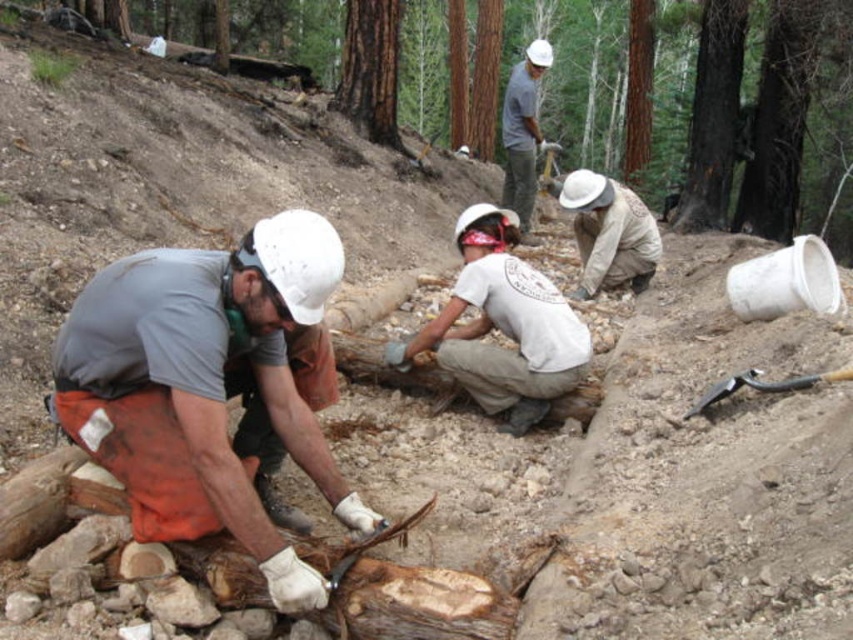
Question: Which point is farther from the camera taking this photo?

Choices:
 (A) coord(293,237)
 (B) coord(567,193)
 (C) coord(538,42)
 (D) coord(837,380)

Answer: (C)

Question: Considering the real-world distances, which object is closest to the camouflage fabric shirt at center?

Choices:
 (A) black metal shovel at lower center
 (B) white matte helmet at center

Answer: (B)

Question: Which of the following is the farthest from the observer?

Choices:
 (A) black metal shovel at lower center
 (B) camouflage fabric shirt at center

Answer: (B)

Question: Considering the relative positions of brown wood log at center and camouflage fabric shirt at center in the image provided, where is brown wood log at center located with respect to camouflage fabric shirt at center?

Choices:
 (A) left
 (B) right

Answer: (A)

Question: Is white matte helmet at center to the right of white matte helmet at upper center from the viewer's perspective?

Choices:
 (A) no
 (B) yes

Answer: (A)

Question: Where is white matte helmet at center located in relation to camouflage fabric shirt at center in the image?

Choices:
 (A) right
 (B) left

Answer: (B)